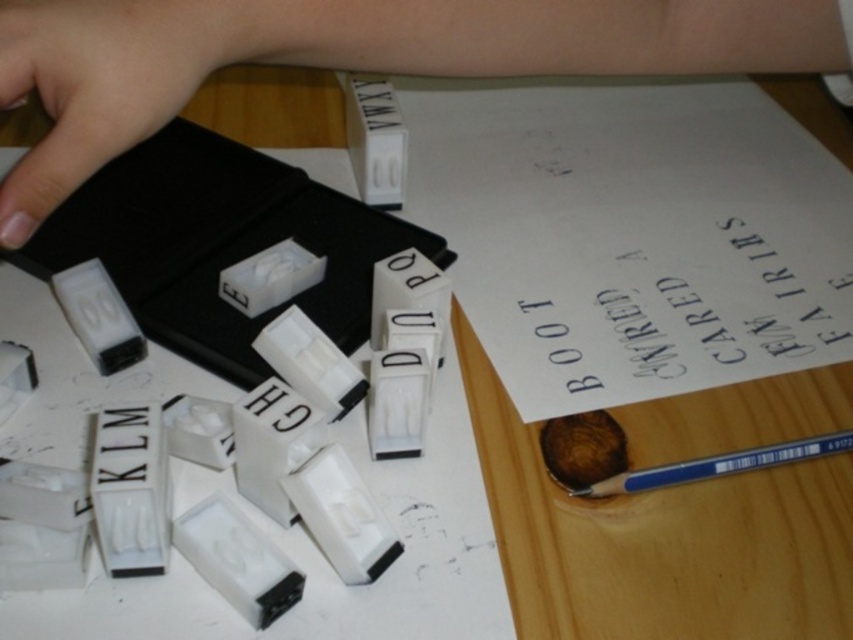
Who is lower down, pink skin at upper center or blue plastic pencil at lower right?

blue plastic pencil at lower right is lower down.

Does pink skin at upper center have a lesser width compared to blue plastic pencil at lower right?

Incorrect, pink skin at upper center's width is not less than blue plastic pencil at lower right's.

Image resolution: width=853 pixels, height=640 pixels. What are the coordinates of `pink skin at upper center` in the screenshot? It's located at (350, 58).

Does pale skin at upper left have a lesser height compared to blue plastic pencil at lower right?

Incorrect, pale skin at upper left's height does not fall short of blue plastic pencil at lower right's.

Is point (125, 106) positioned in front of point (824, 451)?

That is True.

Is point (202, 26) more distant than point (786, 445)?

That is False.

Image resolution: width=853 pixels, height=640 pixels. Identify the location of pale skin at upper left. (97, 84).

Is pink skin at upper center to the right of pale skin at upper left from the viewer's perspective?

Correct, you'll find pink skin at upper center to the right of pale skin at upper left.

Does pink skin at upper center appear under pale skin at upper left?

Incorrect, pink skin at upper center is not positioned below pale skin at upper left.

Image resolution: width=853 pixels, height=640 pixels. Describe the element at coordinates (350, 58) in the screenshot. I see `pink skin at upper center` at that location.

I want to click on pink skin at upper center, so click(x=350, y=58).